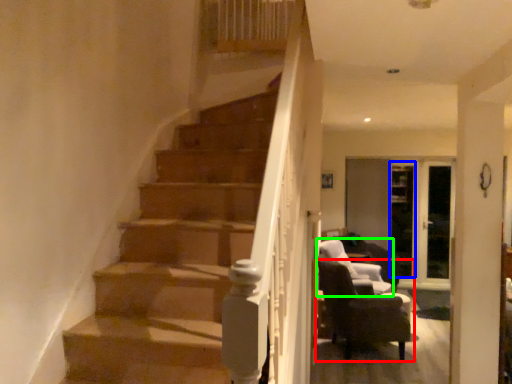
Question: Considering the real-world distances, which object is farthest from chair (highlighted by a red box)? glass door (highlighted by a blue box) or chair (highlighted by a green box)?

Choices:
 (A) glass door
 (B) chair

Answer: (A)